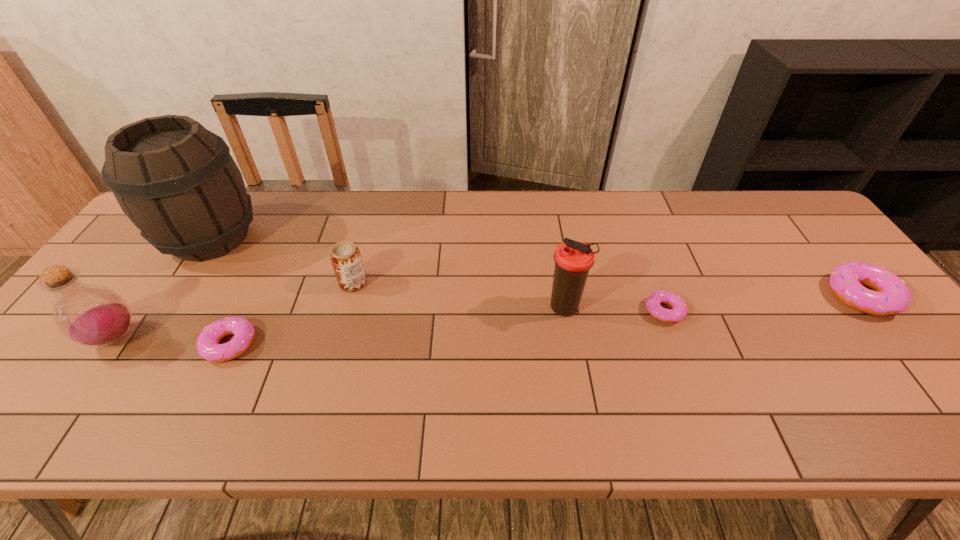
This screenshot has height=540, width=960. I want to click on bottle, so click(x=91, y=315).

You are a GUI agent. You are given a task and a screenshot of the screen. Output one action in this format:
    pyautogui.click(x=<x>, y=<y>)
    Task: Click on the vacant space located on the back of the second shortest doughnut
    
    Given the screenshot: What is the action you would take?
    pyautogui.click(x=260, y=280)

You are a GUI agent. You are given a task and a screenshot of the screen. Output one action in this format:
    pyautogui.click(x=<x>, y=<y>)
    Task: Click on the free space located on the left of the shortest object
    The height and width of the screenshot is (540, 960).
    Given the screenshot: What is the action you would take?
    pyautogui.click(x=609, y=311)

This screenshot has width=960, height=540. I want to click on vacant position located 0.200m on the front of the rightmost object, so click(x=940, y=394).

I want to click on blank space located 0.300m on the right of the tallest object, so click(361, 238).

This screenshot has height=540, width=960. Identify the location of free spot located 0.250m on the front of the fourth tallest object. (327, 376).

Identify the location of blank area located 0.210m on the back of the thermos bottle. (553, 241).

This screenshot has width=960, height=540. Find the location of `vacant space situated 0.300m on the back of the bottle`. vacant space situated 0.300m on the back of the bottle is located at coordinates (185, 238).

Locate an element on the screen. The width and height of the screenshot is (960, 540). object that is at the far edge is located at coordinates (176, 181).

Image resolution: width=960 pixels, height=540 pixels. In order to click on object situated at the near edge in this screenshot , I will do `click(207, 345)`.